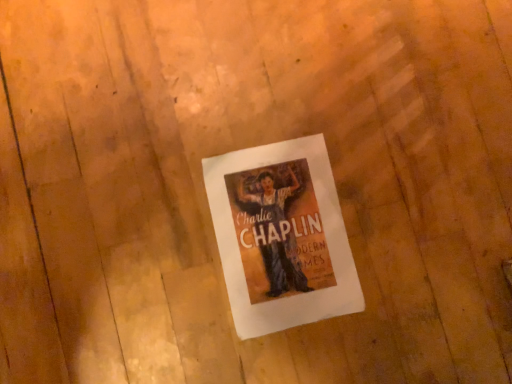
Where is `vacant area that lies in front of white paper at center`? This screenshot has height=384, width=512. vacant area that lies in front of white paper at center is located at coordinates (168, 315).